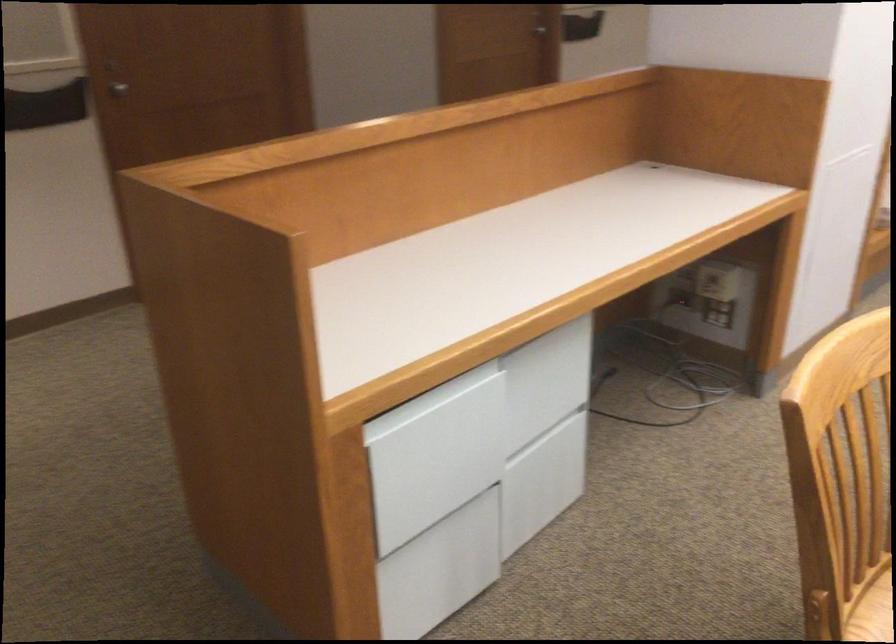
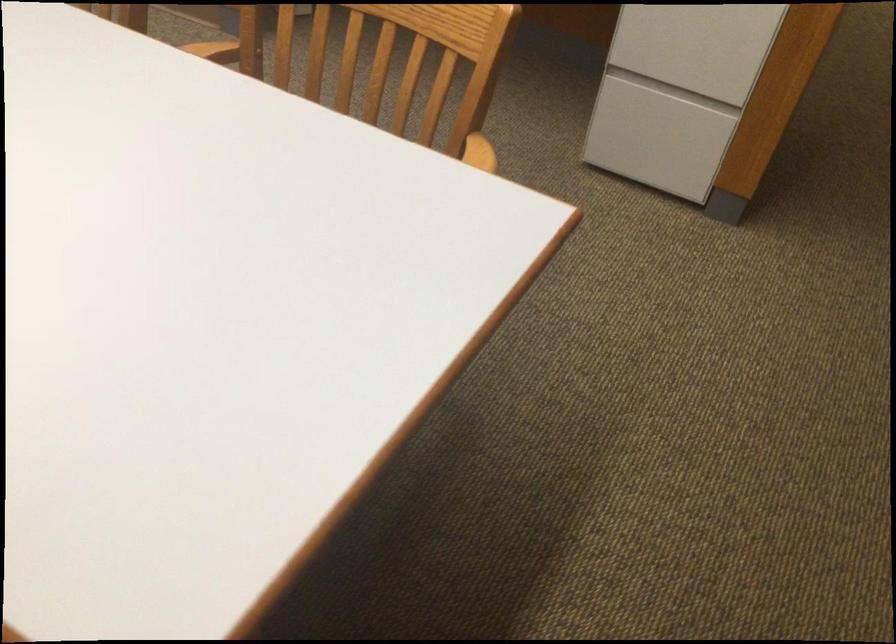
How did the camera likely rotate?

The rotation direction of the camera is right-down.